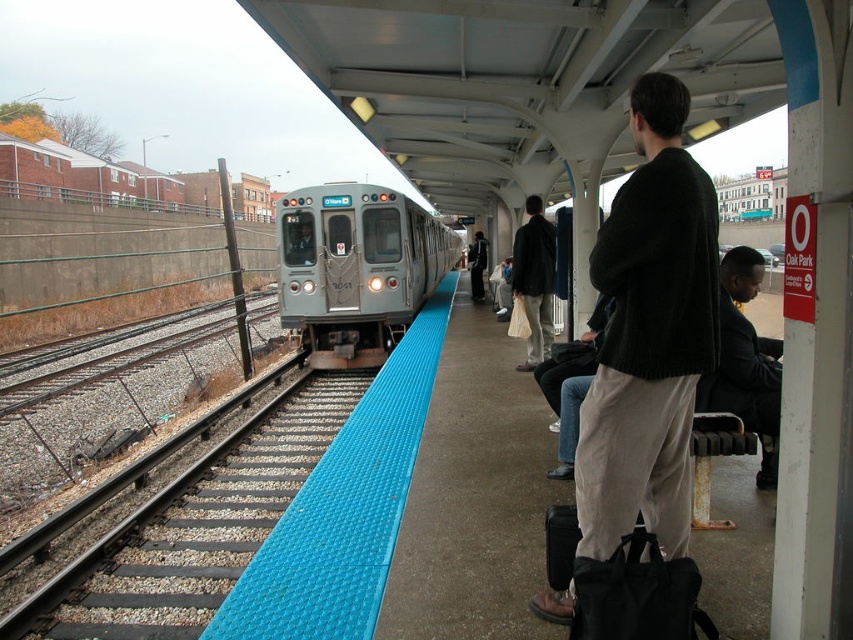
Is smooth steel tracks at left bigger than dark gray sweater at center?

Actually, smooth steel tracks at left might be smaller than dark gray sweater at center.

Who is more distant from viewer, (242, 528) or (480, 234)?

The point (480, 234) is more distant.

You are a GUI agent. You are given a task and a screenshot of the screen. Output one action in this format:
    pyautogui.click(x=<x>, y=<y>)
    Task: Click on the smooth steel tracks at left
    The width and height of the screenshot is (853, 640).
    Given the screenshot: What is the action you would take?
    pyautogui.click(x=192, y=528)

Is point (624, 205) closer to viewer compared to point (474, 300)?

Yes, point (624, 205) is closer to viewer.

Is dark green sweater at center in front of dark gray sweater at center?

Yes.

Where is `dark green sweater at center`? dark green sweater at center is located at coordinates (648, 333).

Is gray metallic train at center thinner than dark suit at right?

In fact, gray metallic train at center might be wider than dark suit at right.

Is gray metallic train at center wider than dark suit at right?

Yes, gray metallic train at center is wider than dark suit at right.

The image size is (853, 640). I want to click on gray metallic train at center, so click(x=357, y=269).

Image resolution: width=853 pixels, height=640 pixels. What are the coordinates of `gray metallic train at center` in the screenshot? It's located at (357, 269).